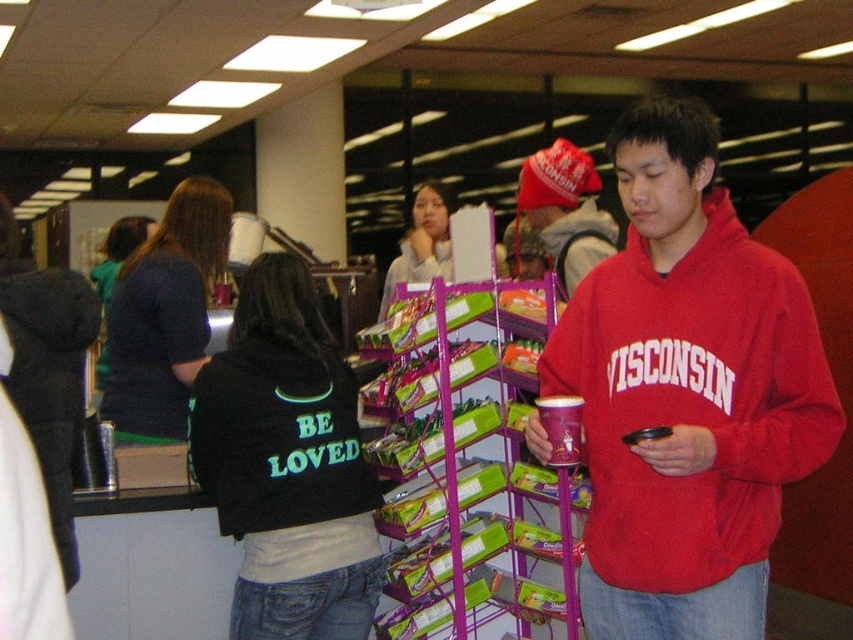
Which is behind, point (622, 148) or point (570, 184)?

The point (570, 184) is behind.

Does red matte sweatshirt at center appear on the left side of matte red beanie at upper center?

No, red matte sweatshirt at center is not to the left of matte red beanie at upper center.

Locate an element on the screen. This screenshot has width=853, height=640. red matte sweatshirt at center is located at coordinates (688, 394).

Does purple plastic shelf at center come in front of matte red beanie at upper center?

Yes, it is.

Can you confirm if purple plastic shelf at center is positioned to the left of matte red beanie at upper center?

Correct, you'll find purple plastic shelf at center to the left of matte red beanie at upper center.

Which is in front, point (483, 413) or point (599, 228)?

Positioned in front is point (483, 413).

This screenshot has width=853, height=640. What are the coordinates of `purple plastic shelf at center` in the screenshot? It's located at (469, 470).

Can you confirm if black fleece jacket at center is shorter than matte red beanie at upper center?

Incorrect, black fleece jacket at center's height does not fall short of matte red beanie at upper center's.

Does black fleece jacket at center have a greater height compared to matte red beanie at upper center?

Yes.

Find the location of a particular element. This screenshot has height=640, width=853. black fleece jacket at center is located at coordinates (287, 465).

The width and height of the screenshot is (853, 640). I want to click on black fleece jacket at center, so click(x=287, y=465).